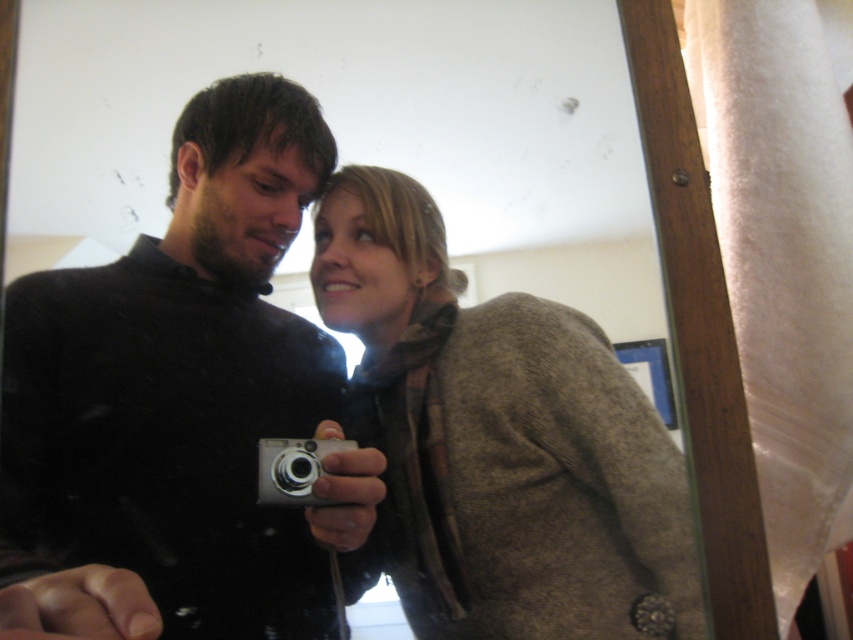
You are a photographer trying to capture a portrait of both the matte black camera at center and the brown woolen coat at center in the mirror reflection. Since the mirror is small, you need to adjust your position so that both objects are fully visible. Based on their current positions, which object should you prioritize keeping centered to ensure it remains in the frame?

The matte black camera at center is in front of the brown woolen coat at center. To ensure both are fully visible in the small mirror, prioritize keeping the matte black camera at center centered, as it is closer to the mirror and might occupy more of the frame.

You are standing in front of a large mirror and see two points reflected in it. The first point is at coordinate point (585, 348) and the second point is at coordinate point (280, 477). Which point appears closer to you in the mirror?

A: Point (585, 348) is further to the camera than point (280, 477), so the point at (280, 477) appears closer to you in the mirror.

Based on the photo, in the scene, there are two people reflected in a mirror. The man on the left is holding a silver digital camera, and the woman on the right is wearing a brown jacket over a patterned scarf. There is also a brown woolen coat represented by the point at coordinates (500, 440). From the perspective of the man holding the camera, which direction should he move to get closer to the brown woolen coat at center?

The brown woolen coat at center is represented by point (500, 440). Since the man is on the left side of the mirror reflection, he should move towards the right to get closer to the brown woolen coat at center.